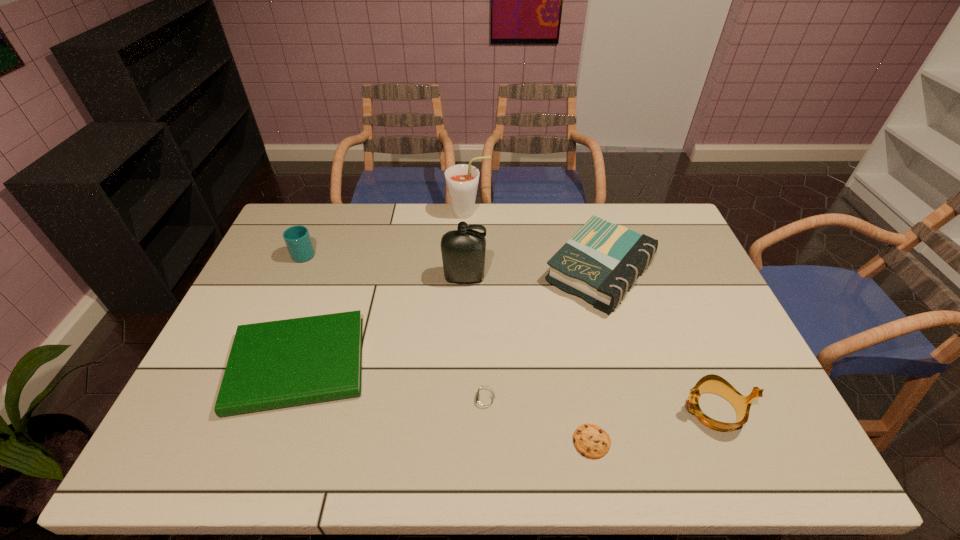
Find the location of `free point that satisfies the following two spatial constraints: 1. on the drink side of the root beer; 2. on the back side of the right paperback book`. free point that satisfies the following two spatial constraints: 1. on the drink side of the root beer; 2. on the back side of the right paperback book is located at coordinates (467, 272).

Where is `blank space that satisfies the following two spatial constraints: 1. on the drink side of the farthest object; 2. on the right side of the cookie`? blank space that satisfies the following two spatial constraints: 1. on the drink side of the farthest object; 2. on the right side of the cookie is located at coordinates (461, 442).

This screenshot has width=960, height=540. In order to click on vacant space that satisfies the following two spatial constraints: 1. on the back side of the cookie; 2. on the drink side of the farthest object in this screenshot , I will do `click(548, 213)`.